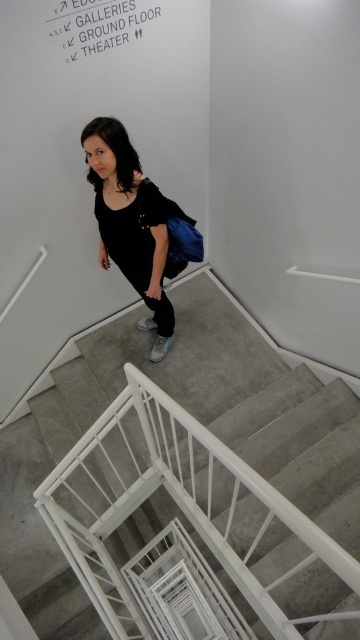
You are navigating through the museum and need to locate two specific points marked on your map. The first point is at coordinates point [356,420] and the second is at point [122,35]. Based on the image, which point is closer to you as you stand at the top of the staircase?

Point [356,420] is closer to you because it is further to the viewer than point [122,35].

You are an interior designer looking at the image of the staircase. The point coordinates given are in the format of X and Y values between 0 and 1, where 0 is the bottom left corner and 1 is the top right corner of the image. Which object from the scene is located at point coordinates (135, 230)?

The point coordinates (135, 230) correspond to the black matte dress at center.

You are an art gallery attendant who needs to direct visitors to the GALLERIES. A visitor asks you where the GALLERIES are located. You see the matte black dress at center and the white paper sign at upper center. Which object should you point to to indicate the direction?

You should point to the white paper sign at upper center because the matte black dress at center is in front of it, so the sign is behind the dress and likely contains the directions to the GALLERIES.